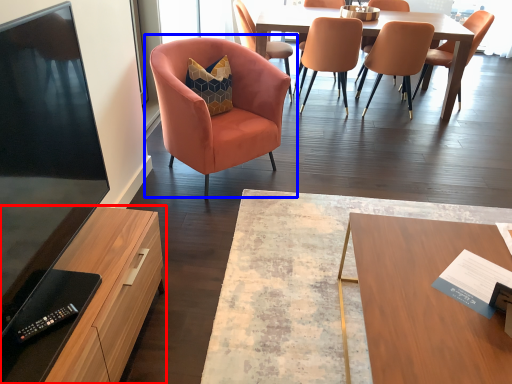
Question: Which object appears farthest to the camera in this image, cabinetry (highlighted by a red box) or chair (highlighted by a blue box)?

Choices:
 (A) cabinetry
 (B) chair

Answer: (B)